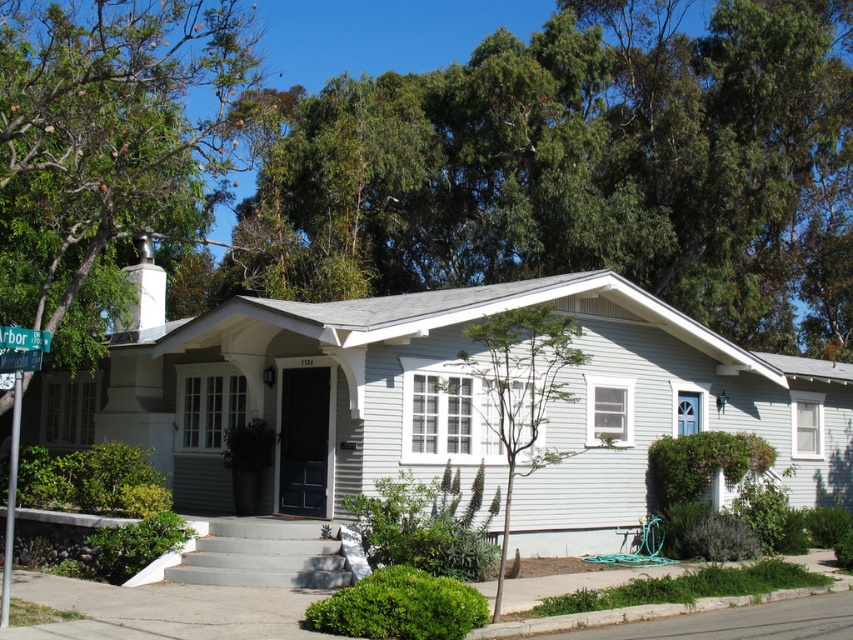
You are a delivery person approaching the house and notice the green leafy tree at upper center and the green plastic street sign at upper left. Which object is higher in the image?

The green leafy tree at upper center is taller than the green plastic street sign at upper left, so the green leafy tree at upper center is higher in the image.

You are a drone operator planning to fly a drone between the green leafy tree at upper center and the green plastic street sign at upper left. The drone has a maximum flight distance of 25 meters. Can the drone safely make the trip between these two objects without exceeding its range?

The green leafy tree at upper center and green plastic street sign at upper left are 26.76 meters apart from each other. Since the drone can only fly up to 25 meters, it cannot safely make the trip between these two objects without exceeding its range.

You are a gardener who needs to trim the green leafy tree at upper center and the green plastic street sign at left. Which object requires you to use a taller ladder?

The green leafy tree at upper center requires a taller ladder because it is taller than the green plastic street sign at left.